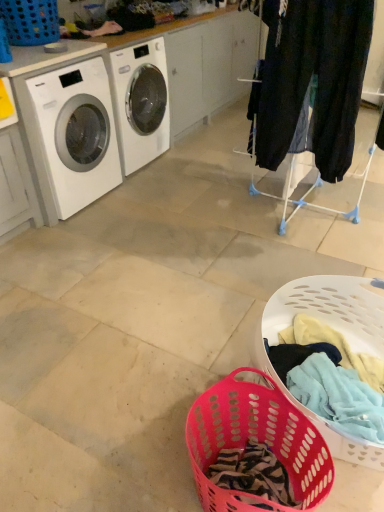
What do you see at coordinates (257, 440) in the screenshot? The height and width of the screenshot is (512, 384). I see `translucent plastic laundry basket at lower center, which is the 2th basket in right-to-left order` at bounding box center [257, 440].

The height and width of the screenshot is (512, 384). I want to click on white glossy washing machine at left, so click(x=70, y=135).

Describe the element at coordinates (30, 21) in the screenshot. I see `blue plastic laundry basket at upper left, acting as the 1th basket starting from the back` at that location.

In order to click on translucent plastic laundry basket at lower center, which is the 2th basket in right-to-left order in this screenshot , I will do `click(257, 440)`.

Does point (378, 446) come behind point (259, 410)?

No, it is in front of (259, 410).

How different are the orientations of pink plastic laundry basket at lower center, the second basket positioned from the back, and translucent plastic laundry basket at lower center, which is the 2th basket in right-to-left order, in degrees?

There is a 32.3-degree angle between the facing directions of pink plastic laundry basket at lower center, the second basket positioned from the back, and translucent plastic laundry basket at lower center, which is the 2th basket in right-to-left order.

From the image's perspective, between pink plastic laundry basket at lower center, the second basket positioned from the back, and translucent plastic laundry basket at lower center, the 2th basket from the left, which one is located above?

pink plastic laundry basket at lower center, the second basket positioned from the back.

Do you think pink plastic laundry basket at lower center, which ranks as the 2th basket in front-to-back order, is within translucent plastic laundry basket at lower center, acting as the 1th basket starting from the bottom, or outside of it?

pink plastic laundry basket at lower center, which ranks as the 2th basket in front-to-back order, is spatially situated outside translucent plastic laundry basket at lower center, acting as the 1th basket starting from the bottom.

From the image's perspective, relative to pink plastic laundry basket at lower center, arranged as the third basket when viewed from the left, is blue plastic laundry basket at upper left, the first basket positioned from the left, above or below?

Clearly, from the image's perspective, blue plastic laundry basket at upper left, the first basket positioned from the left, is above pink plastic laundry basket at lower center, arranged as the third basket when viewed from the left.

Which is more to the right, blue plastic laundry basket at upper left, the 1th basket when ordered from top to bottom, or pink plastic laundry basket at lower center, which ranks as the 2th basket in front-to-back order?

From the viewer's perspective, pink plastic laundry basket at lower center, which ranks as the 2th basket in front-to-back order, appears more on the right side.

Consider the image. From a real-world perspective, is blue plastic laundry basket at upper left, the third basket viewed from the right, located beneath pink plastic laundry basket at lower center, which ranks as the 2th basket in front-to-back order?

No.

From the image's perspective, which object appears higher, translucent plastic laundry basket at lower center, acting as the 1th basket starting from the bottom, or blue plastic laundry basket at upper left, the first basket positioned from the left?

blue plastic laundry basket at upper left, the first basket positioned from the left, appears higher in the image.

From a real-world perspective, is translucent plastic laundry basket at lower center, the 3th basket viewed from the back, on blue plastic laundry basket at upper left, which is the third basket from bottom to top?

No.

Can you confirm if translucent plastic laundry basket at lower center, acting as the 1th basket starting from the bottom, is thinner than blue plastic laundry basket at upper left, which is the third basket from bottom to top?

In fact, translucent plastic laundry basket at lower center, acting as the 1th basket starting from the bottom, might be wider than blue plastic laundry basket at upper left, which is the third basket from bottom to top.

Can you confirm if translucent plastic laundry basket at lower center, which is the 2th basket in right-to-left order, is positioned to the left of blue plastic laundry basket at upper left, acting as the 1th basket starting from the back?

Incorrect, translucent plastic laundry basket at lower center, which is the 2th basket in right-to-left order, is not on the left side of blue plastic laundry basket at upper left, acting as the 1th basket starting from the back.

Could you tell me if blue plastic laundry basket at upper left, the 1th basket when ordered from top to bottom, is turned towards translucent plastic laundry basket at lower center, the 3th basket viewed from the back?

No, blue plastic laundry basket at upper left, the 1th basket when ordered from top to bottom, is not turned towards translucent plastic laundry basket at lower center, the 3th basket viewed from the back.

Would you say blue plastic laundry basket at upper left, the third basket viewed from the right, is inside or outside translucent plastic laundry basket at lower center, the 1th basket in the front-to-back sequence?

blue plastic laundry basket at upper left, the third basket viewed from the right, is not inside translucent plastic laundry basket at lower center, the 1th basket in the front-to-back sequence, it's outside.

Looking at their sizes, would you say blue plastic laundry basket at upper left, acting as the 1th basket starting from the back, is wider or thinner than translucent plastic laundry basket at lower center, which ranks as the 3th basket in top-to-bottom order?

blue plastic laundry basket at upper left, acting as the 1th basket starting from the back, is thinner than translucent plastic laundry basket at lower center, which ranks as the 3th basket in top-to-bottom order.

Measure the distance from blue plastic laundry basket at upper left, acting as the 1th basket starting from the back, to dark blue jeans at right.

The distance of blue plastic laundry basket at upper left, acting as the 1th basket starting from the back, from dark blue jeans at right is 1.49 meters.

From the image's perspective, is blue plastic laundry basket at upper left, the third basket viewed from the right, positioned above or below dark blue jeans at right?

blue plastic laundry basket at upper left, the third basket viewed from the right, is above dark blue jeans at right.

Is blue plastic laundry basket at upper left, the third basket viewed from the right, positioned far away from dark blue jeans at right?

blue plastic laundry basket at upper left, the third basket viewed from the right, is positioned a significant distance from dark blue jeans at right.

Could you tell me if blue plastic laundry basket at upper left, the first basket positioned from the left, is facing dark blue jeans at right?

Yes, blue plastic laundry basket at upper left, the first basket positioned from the left, is turned towards dark blue jeans at right.

How much distance is there between translucent plastic laundry basket at lower center, which is the 2th basket in right-to-left order, and pink plastic laundry basket at lower center, the second basket positioned from the back?

translucent plastic laundry basket at lower center, which is the 2th basket in right-to-left order, is 8.29 inches away from pink plastic laundry basket at lower center, the second basket positioned from the back.

From the picture: What's the angular difference between translucent plastic laundry basket at lower center, which is the 2th basket in right-to-left order, and pink plastic laundry basket at lower center, positioned as the second basket in bottom-to-top order,'s facing directions?

translucent plastic laundry basket at lower center, which is the 2th basket in right-to-left order, and pink plastic laundry basket at lower center, positioned as the second basket in bottom-to-top order, are facing 32.3 degrees away from each other.

Is translucent plastic laundry basket at lower center, the 3th basket viewed from the back, aimed at pink plastic laundry basket at lower center, positioned as the second basket in bottom-to-top order?

Yes, translucent plastic laundry basket at lower center, the 3th basket viewed from the back, is turned towards pink plastic laundry basket at lower center, positioned as the second basket in bottom-to-top order.

Would you say translucent plastic laundry basket at lower center, acting as the 1th basket starting from the bottom, is outside pink plastic laundry basket at lower center, which ranks as the 2th basket in top-to-bottom order?

Yes, translucent plastic laundry basket at lower center, acting as the 1th basket starting from the bottom, is located beyond the bounds of pink plastic laundry basket at lower center, which ranks as the 2th basket in top-to-bottom order.

From the picture: Which is less distant, (57, 118) or (278, 12)?

Clearly, point (57, 118) is more distant from the camera than point (278, 12).

Consider the image. Is white glossy washing machine at left positioned with its back to dark blue jeans at right?

No, white glossy washing machine at left's orientation is not away from dark blue jeans at right.

From the picture: Is white glossy washing machine at left at the right side of dark blue jeans at right?

No.

From the picture: How far apart are white glossy washing machine at left and dark blue jeans at right?

white glossy washing machine at left is 1.20 meters from dark blue jeans at right.

From the image's perspective, starting from the translucent plastic laundry basket at lower center, the 2th basket from the left, which basket is the 1st one above? Please provide its 2D coordinates.

[(337, 330)]

From the image's perspective, starting from the blue plastic laundry basket at upper left, the 1th basket when ordered from top to bottom, which basket is the 1st one below? Please provide its 2D coordinates.

[(337, 330)]

Estimate the real-world distances between objects in this image. Which object is further from pink plastic laundry basket at lower center, the second basket positioned from the back, white glossy washing machine at left or blue plastic laundry basket at upper left, the third basket viewed from the right?

blue plastic laundry basket at upper left, the third basket viewed from the right, is further to pink plastic laundry basket at lower center, the second basket positioned from the back.

Looking at the image, which one is located closer to white glossy washing machine at left, blue plastic laundry basket at upper left, acting as the 1th basket starting from the back, or translucent plastic laundry basket at lower center, the 1th basket in the front-to-back sequence?

blue plastic laundry basket at upper left, acting as the 1th basket starting from the back, is closer to white glossy washing machine at left.

When comparing their distances from translucent plastic laundry basket at lower center, acting as the 1th basket starting from the bottom, does blue plastic laundry basket at upper left, which is the third basket from bottom to top, or white glossy washing machine at left seem closer?

Among the two, white glossy washing machine at left is located nearer to translucent plastic laundry basket at lower center, acting as the 1th basket starting from the bottom.

From the image, which object appears to be farther from white glossy washing machine at left, translucent plastic laundry basket at lower center, the 1th basket in the front-to-back sequence, or pink plastic laundry basket at lower center, which ranks as the 2th basket in front-to-back order?

translucent plastic laundry basket at lower center, the 1th basket in the front-to-back sequence, lies further to white glossy washing machine at left than the other object.

Looking at the image, which one is located closer to blue plastic laundry basket at upper left, which is the third basket from bottom to top, dark blue jeans at right or translucent plastic laundry basket at lower center, which is the 2th basket in right-to-left order?

Among the two, dark blue jeans at right is located nearer to blue plastic laundry basket at upper left, which is the third basket from bottom to top.

Considering their positions, is white glossy washing machine at left positioned further to dark blue jeans at right than pink plastic laundry basket at lower center, acting as the 1th basket starting from the right?

white glossy washing machine at left.

Considering their positions, is white glossy washing machine at left positioned further to dark blue jeans at right than blue plastic laundry basket at upper left, which is the third basket from bottom to top?

blue plastic laundry basket at upper left, which is the third basket from bottom to top, is positioned further to the anchor dark blue jeans at right.

From the image, which object appears to be farther from blue plastic laundry basket at upper left, the first basket positioned from the left, white glossy washing machine at left or translucent plastic laundry basket at lower center, which ranks as the 3th basket in top-to-bottom order?

translucent plastic laundry basket at lower center, which ranks as the 3th basket in top-to-bottom order, lies further to blue plastic laundry basket at upper left, the first basket positioned from the left, than the other object.

Identify the location of basket between blue plastic laundry basket at upper left, the 3th basket from the front, and translucent plastic laundry basket at lower center, the 2th basket from the left, from top to bottom. The width and height of the screenshot is (384, 512). (337, 330).

This screenshot has height=512, width=384. Identify the location of washing machine between blue plastic laundry basket at upper left, which is the third basket from bottom to top, and translucent plastic laundry basket at lower center, which ranks as the 3th basket in top-to-bottom order, from top to bottom. (70, 135).

Find the location of a particular element. The width and height of the screenshot is (384, 512). clothing between white glossy washing machine at left and translucent plastic laundry basket at lower center, the 1th basket in the front-to-back sequence, in the vertical direction is located at coordinates (311, 82).

This screenshot has width=384, height=512. In order to click on clothing between blue plastic laundry basket at upper left, the third basket viewed from the right, and translucent plastic laundry basket at lower center, which ranks as the 3th basket in top-to-bottom order, in the up-down direction in this screenshot , I will do `click(311, 82)`.